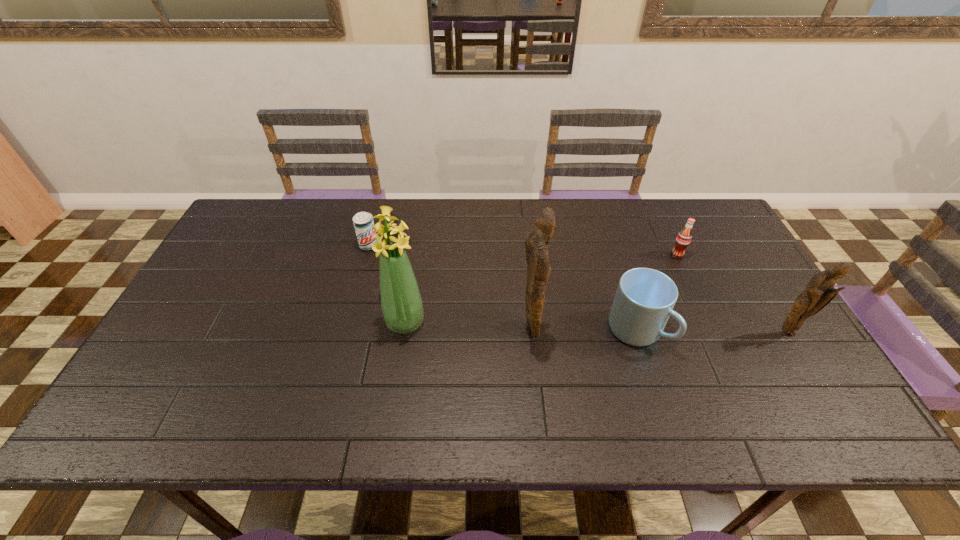
What are the coordinates of `the taller figurine` in the screenshot? It's located at (536, 242).

You are a GUI agent. You are given a task and a screenshot of the screen. Output one action in this format:
    pyautogui.click(x=<x>, y=<y>)
    Task: Click on the third object from left to right
    
    Given the screenshot: What is the action you would take?
    pyautogui.click(x=536, y=242)

Image resolution: width=960 pixels, height=540 pixels. I want to click on the rightmost object, so click(x=819, y=292).

Find the location of `the third tallest object`. the third tallest object is located at coordinates (819, 292).

This screenshot has height=540, width=960. In order to click on the shortest object in this screenshot , I will do tap(363, 222).

Find the location of `beer can`. beer can is located at coordinates (363, 222).

You are a GUI agent. You are given a task and a screenshot of the screen. Output one action in this format:
    pyautogui.click(x=<x>, y=<y>)
    Task: Click on the soda
    
    Given the screenshot: What is the action you would take?
    pyautogui.click(x=683, y=239)

Where is `the third object from right to left`? the third object from right to left is located at coordinates (645, 298).

The width and height of the screenshot is (960, 540). Find the location of `bouquet`. bouquet is located at coordinates (401, 302).

Image resolution: width=960 pixels, height=540 pixels. I want to click on free spot located on the front-facing side of the left figurine, so click(x=645, y=332).